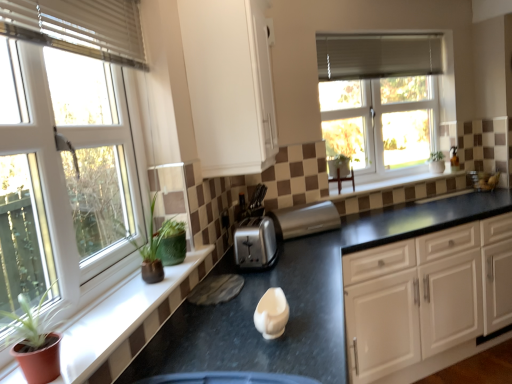
This screenshot has width=512, height=384. In order to click on empty space that is ontop of satin silver toaster at center, placed as the 2th appliance when sorted from front to back (from a real-world perspective) in this screenshot , I will do `click(300, 210)`.